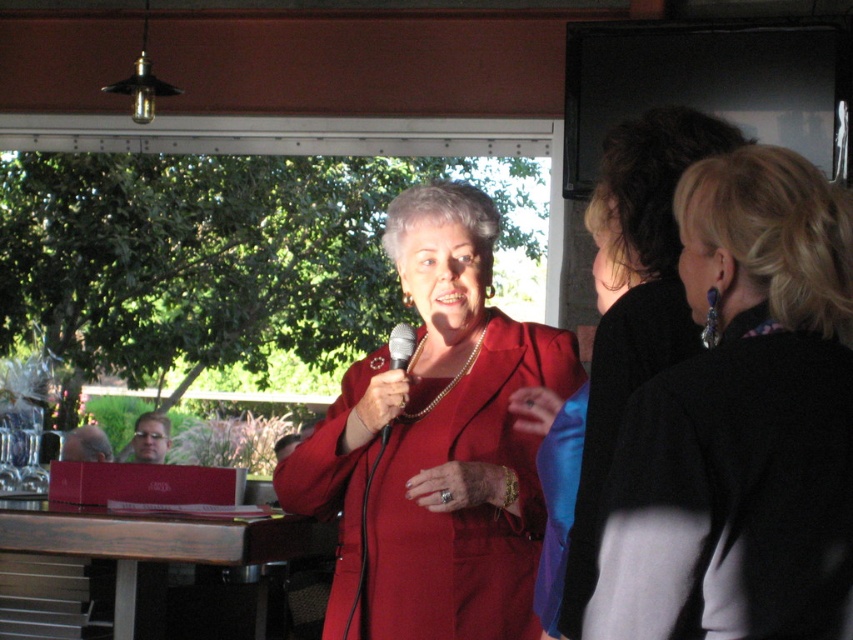
You are standing at the center of the event area and see the woman in the red blazer and red dress holding the microphone. There is also a point marked at coordinates (x=741, y=424). What object is located at that point?

The point at coordinates (x=741, y=424) corresponds to the black fabric jacket at upper right.

You are standing at the speaker in the red blazer and dress. You notice two points in the scene. The first point is at coordinate (646,176) and the second is at (392,336). Which point is closer to you?

Point (646,176) is in front of point (392,336), so it is closer to you.

Based on the scene description and the coordinates provided, can you identify which object corresponds to the point labeled as point (616,333)?

The point (616,333) corresponds to the matte red blazer at center.